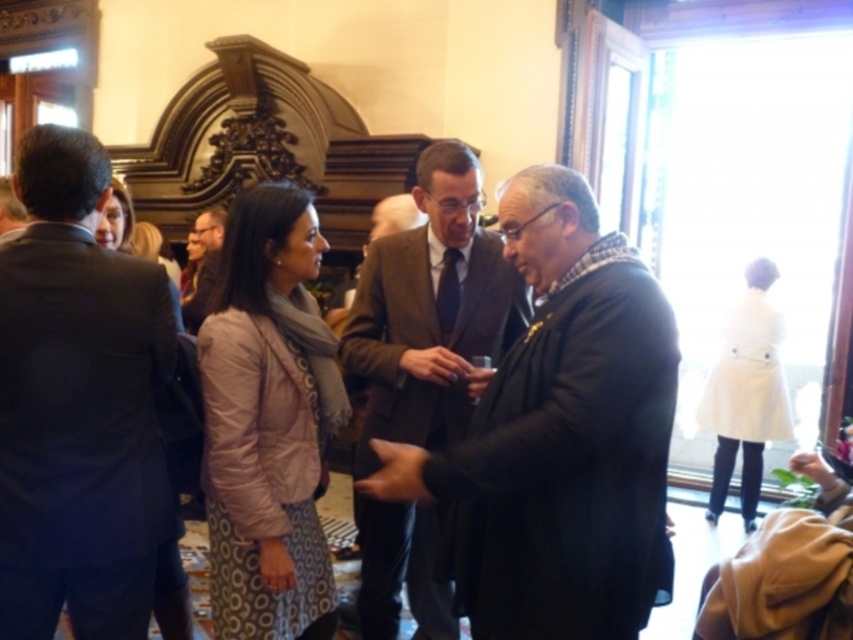
You are organizing a photo shoot and need to ensure that the pale pink quilted jacket at center and the brown wool suit at center are positioned in a way that they are exactly 60 centimeters apart. Based on their current positions, is there enough space between them to meet this requirement?

The pale pink quilted jacket at center and brown wool suit at center are currently 67.10 centimeters apart, which is more than the required 60 centimeters. To meet the exact requirement, you would need to move them closer by approximately 7.10 centimeters.

You are planning to seat guests at a table that can accommodate two people side by side. Given the sizes of the dark blue suit at left and the pale pink quilted jacket at center, which guest should you choose to seat comfortably?

The dark blue suit at left has a smaller width than the pale pink quilted jacket at center, so seating the guest in the dark blue suit at left would be more comfortable as they require less space.

You are a photographer at the event and want to capture a photo that includes both the dark blue suit at left and the pale pink quilted jacket at center. Based on their positions, which one should you focus on first to ensure both are in frame?

The dark blue suit at left is located above the pale pink quilted jacket at center, so you should focus on the pale pink quilted jacket at center first to ensure both are in frame.